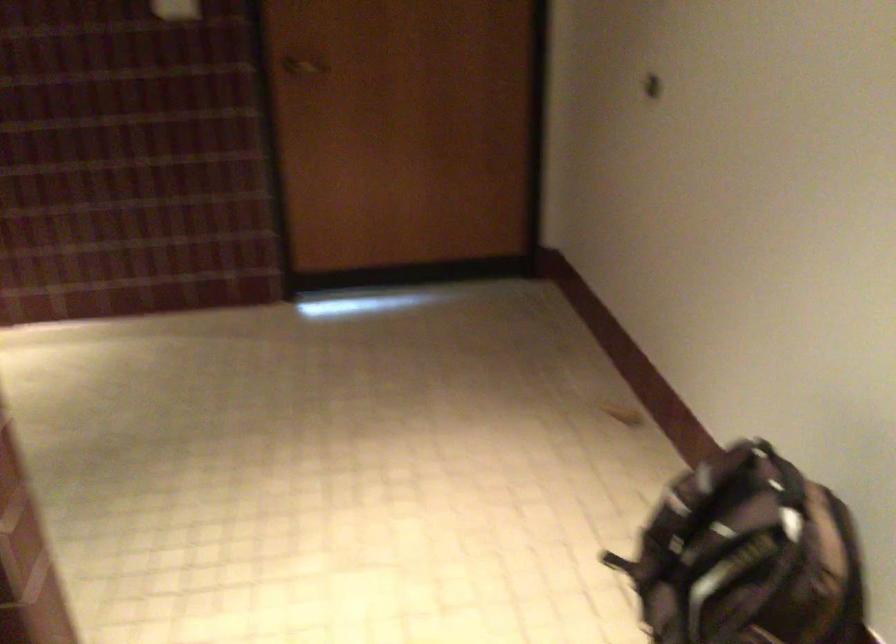
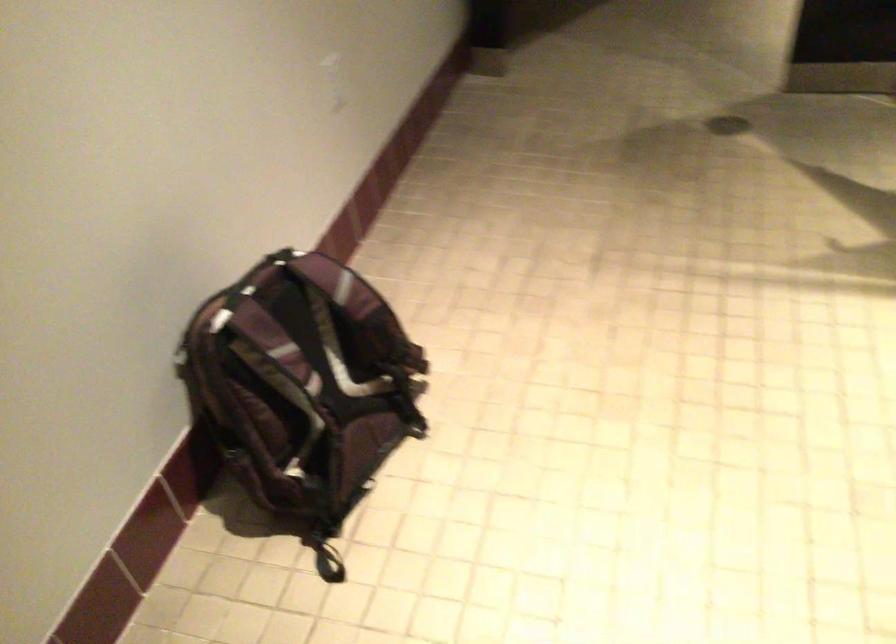
Locate, in the second image, the point that corresponds to [631,569] in the first image.

(328, 567)